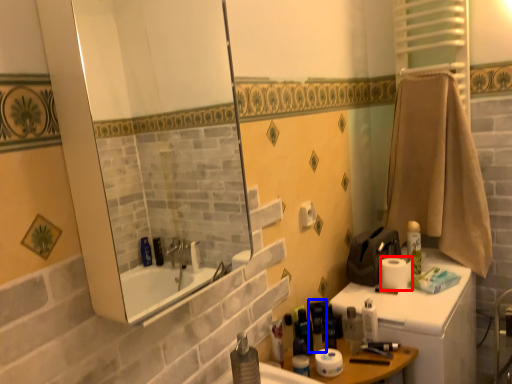
Question: Which object is further to the camera taking this photo, toilet paper (highlighted by a red box) or toiletry (highlighted by a blue box)?

Choices:
 (A) toilet paper
 (B) toiletry

Answer: (A)